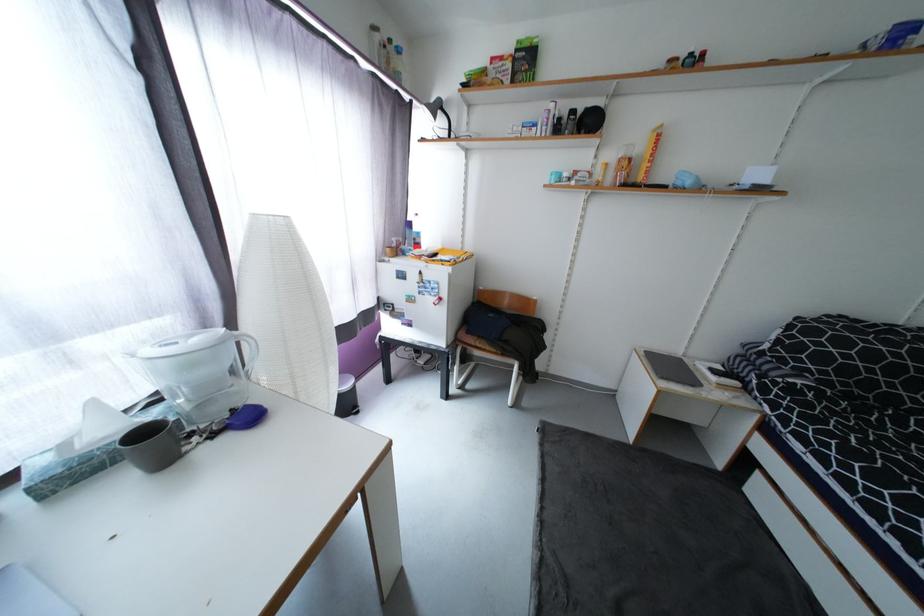
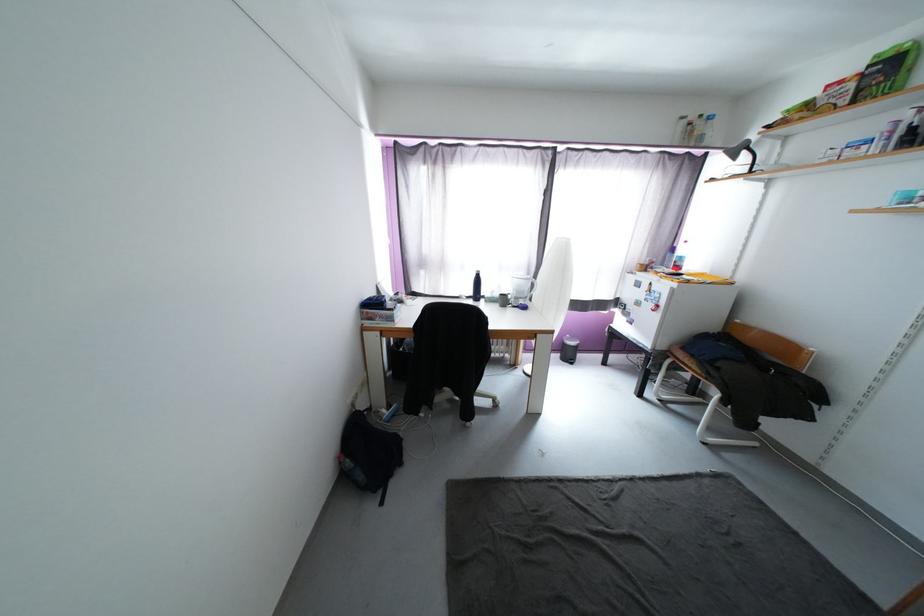
Find the pixel in the second image that matches the point at 444,114 in the first image.

(749, 154)